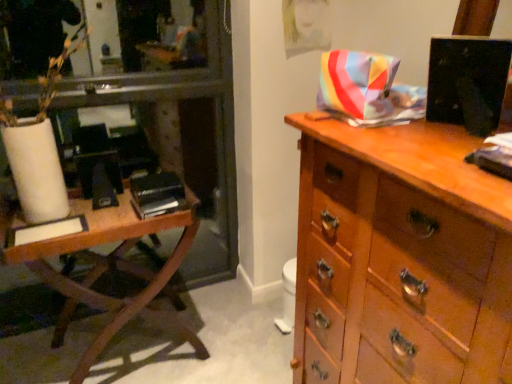
Find the location of a particular element. The width and height of the screenshot is (512, 384). free spot in front of black glossy monitor at upper right is located at coordinates (449, 144).